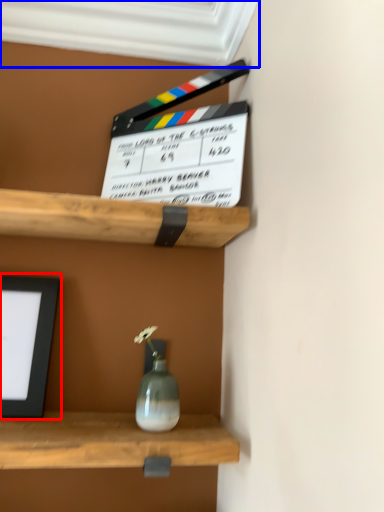
Question: Among these objects, which one is nearest to the camera, picture frame (highlighted by a red box) or window frame (highlighted by a blue box)?

Choices:
 (A) picture frame
 (B) window frame

Answer: (B)